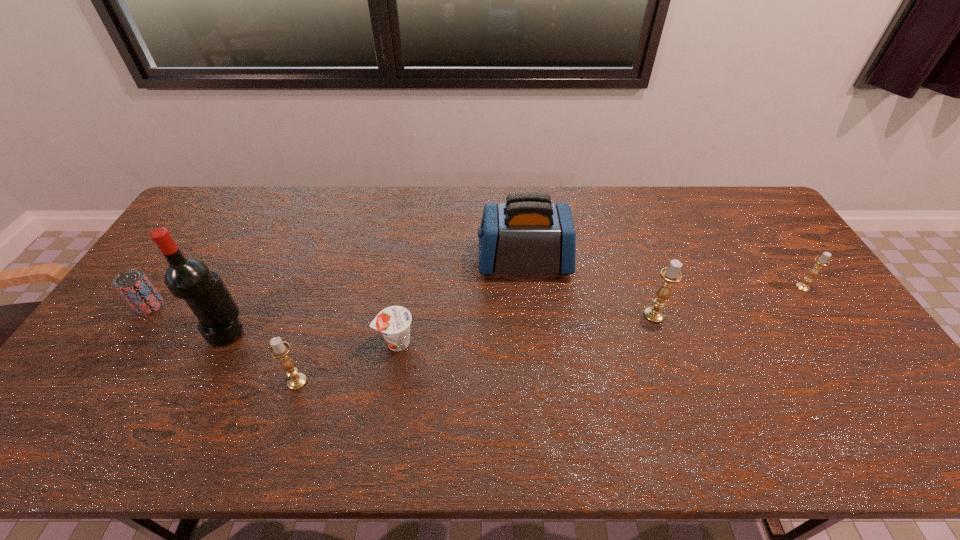
At what (x,y) coordinates should I click in order to perform the action: click on the shortest object. Please return your answer as a coordinate pair (x, y). The image size is (960, 540). Looking at the image, I should click on click(394, 322).

Identify the location of the fourth object from right to left. Image resolution: width=960 pixels, height=540 pixels. (394, 322).

The height and width of the screenshot is (540, 960). What are the coordinates of `toaster` in the screenshot? It's located at (528, 234).

The height and width of the screenshot is (540, 960). Find the location of `the third object from right to left`. the third object from right to left is located at coordinates (528, 234).

Locate an element on the screen. The width and height of the screenshot is (960, 540). vacant area situated on the left of the third object from left to right is located at coordinates (195, 381).

Identify the location of vacant region located on the left of the tallest candle holder. This screenshot has width=960, height=540. (510, 315).

Locate an element on the screen. This screenshot has width=960, height=540. vacant area situated on the left of the rightmost candle holder is located at coordinates (750, 287).

Image resolution: width=960 pixels, height=540 pixels. What are the coordinates of `free space located on the back of the tallest object` in the screenshot? It's located at (244, 296).

Locate an element on the screen. This screenshot has width=960, height=540. free space located 0.230m on the front of the beer can is located at coordinates (93, 388).

Find the location of `free location located 0.220m on the left of the fourth object from left to right`. free location located 0.220m on the left of the fourth object from left to right is located at coordinates (295, 342).